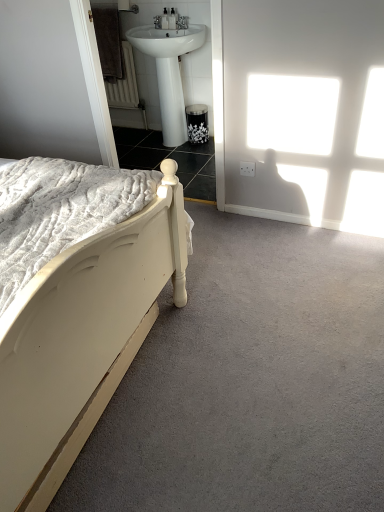
Question: Is white painted wood bed at left in front of white glossy sink at upper center?

Choices:
 (A) yes
 (B) no

Answer: (A)

Question: Is white painted wood bed at left at the left side of white glossy sink at upper center?

Choices:
 (A) no
 (B) yes

Answer: (B)

Question: Does white painted wood bed at left come behind white glossy sink at upper center?

Choices:
 (A) yes
 (B) no

Answer: (B)

Question: From the image's perspective, would you say white painted wood bed at left is positioned over white glossy sink at upper center?

Choices:
 (A) no
 (B) yes

Answer: (A)

Question: Is white painted wood bed at left in contact with white glossy sink at upper center?

Choices:
 (A) yes
 (B) no

Answer: (B)

Question: From a real-world perspective, is white painted wood bed at left below white glossy sink at upper center?

Choices:
 (A) no
 (B) yes

Answer: (A)

Question: Could you tell me if white glossy sink at upper center is facing black metal towel bar at upper center?

Choices:
 (A) no
 (B) yes

Answer: (A)

Question: Can we say white glossy sink at upper center lies outside black metal towel bar at upper center?

Choices:
 (A) yes
 (B) no

Answer: (A)

Question: Is white glossy sink at upper center bigger than black metal towel bar at upper center?

Choices:
 (A) yes
 (B) no

Answer: (A)

Question: Is white glossy sink at upper center smaller than black metal towel bar at upper center?

Choices:
 (A) yes
 (B) no

Answer: (B)

Question: Is white glossy sink at upper center facing away from black metal towel bar at upper center?

Choices:
 (A) yes
 (B) no

Answer: (B)

Question: Is white glossy sink at upper center positioned in front of black metal towel bar at upper center?

Choices:
 (A) no
 (B) yes

Answer: (B)

Question: Would you say white painted wood bed at left is part of white glossy sink at upper center's contents?

Choices:
 (A) no
 (B) yes

Answer: (A)